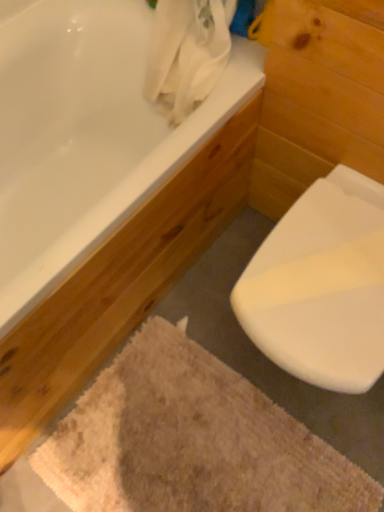
Question: From a real-world perspective, does white glossy toilet at lower right sit lower than beige textured bath mat at lower center?

Choices:
 (A) yes
 (B) no

Answer: (B)

Question: Is white glossy toilet at lower right shorter than beige textured bath mat at lower center?

Choices:
 (A) no
 (B) yes

Answer: (A)

Question: From a real-world perspective, does white glossy toilet at lower right stand above beige textured bath mat at lower center?

Choices:
 (A) no
 (B) yes

Answer: (B)

Question: Is white glossy toilet at lower right smaller than beige textured bath mat at lower center?

Choices:
 (A) yes
 (B) no

Answer: (B)

Question: Would you consider white glossy toilet at lower right to be distant from beige textured bath mat at lower center?

Choices:
 (A) no
 (B) yes

Answer: (A)

Question: Is white glossy toilet at lower right wider than beige textured bath mat at lower center?

Choices:
 (A) yes
 (B) no

Answer: (B)

Question: Considering the relative sizes of beige textured bath mat at lower center and white glossy bathtub at upper left in the image provided, is beige textured bath mat at lower center smaller than white glossy bathtub at upper left?

Choices:
 (A) no
 (B) yes

Answer: (B)

Question: Does beige textured bath mat at lower center appear on the left side of white glossy bathtub at upper left?

Choices:
 (A) no
 (B) yes

Answer: (A)

Question: Does beige textured bath mat at lower center come behind white glossy bathtub at upper left?

Choices:
 (A) yes
 (B) no

Answer: (A)

Question: Is beige textured bath mat at lower center wider than white glossy bathtub at upper left?

Choices:
 (A) yes
 (B) no

Answer: (B)

Question: Can you confirm if beige textured bath mat at lower center is positioned to the right of white glossy bathtub at upper left?

Choices:
 (A) yes
 (B) no

Answer: (A)

Question: Is beige textured bath mat at lower center taller than white glossy bathtub at upper left?

Choices:
 (A) yes
 (B) no

Answer: (B)

Question: From a real-world perspective, is white glossy bathtub at upper left located beneath beige textured bath mat at lower center?

Choices:
 (A) no
 (B) yes

Answer: (A)